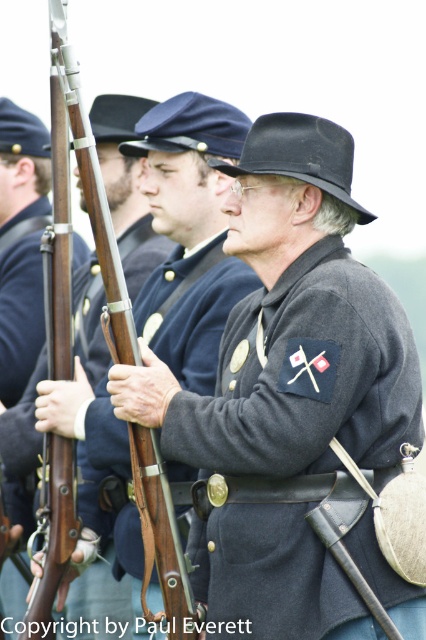
Question: Can you confirm if dark gray wool jacket at center is smaller than wooden rifle at center?

Choices:
 (A) yes
 (B) no

Answer: (B)

Question: Which of the following is the farthest from the observer?

Choices:
 (A) (370, 461)
 (B) (37, 228)

Answer: (B)

Question: Is matte gray uniform at center above wooden rifle at center?

Choices:
 (A) no
 (B) yes

Answer: (A)

Question: Considering the real-world distances, which object is closest to the matte gray uniform at center?

Choices:
 (A) dark gray wool jacket at center
 (B) wooden rifle at center

Answer: (A)

Question: Which of the following is the closest to the observer?

Choices:
 (A) matte gray uniform at center
 (B) wooden rifle at center
 (C) dark gray wool jacket at center

Answer: (C)

Question: Is dark gray wool jacket at center bigger than matte gray uniform at center?

Choices:
 (A) no
 (B) yes

Answer: (B)